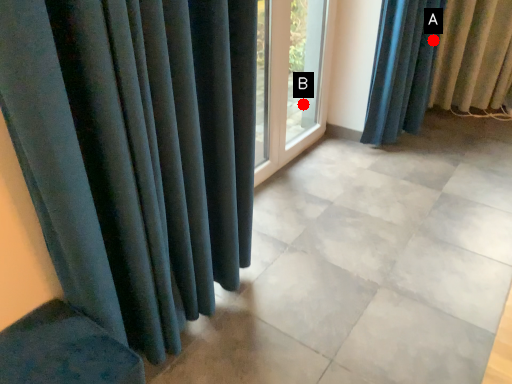
Question: Two points are circled on the image, labeled by A and B beside each circle. Which point is closer to the camera?

Choices:
 (A) A is closer
 (B) B is closer

Answer: (A)